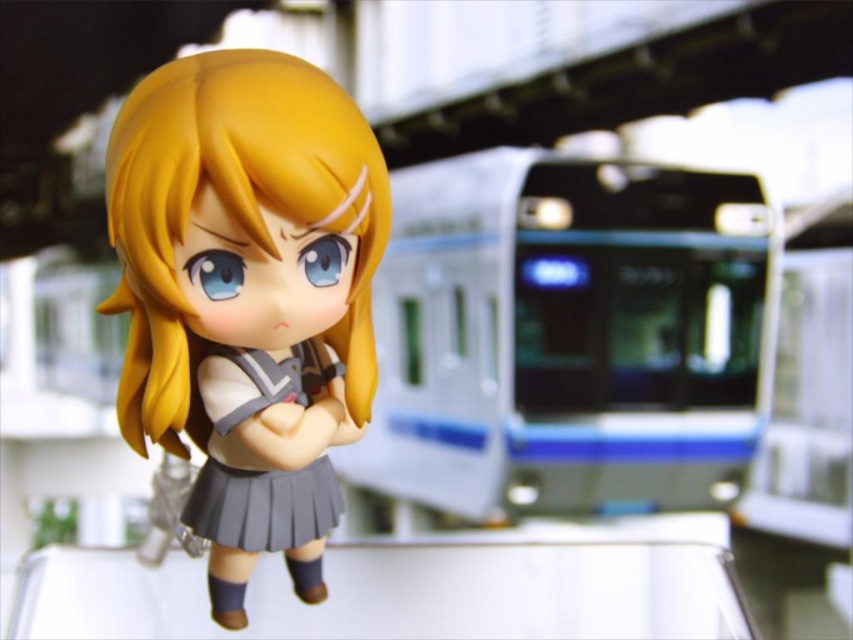
Question: Can you confirm if metallic silver train at center is thinner than gray pleated skirt at center?

Choices:
 (A) no
 (B) yes

Answer: (A)

Question: Where is metallic silver train at center located in relation to matte plastic doll at center in the image?

Choices:
 (A) below
 (B) above

Answer: (B)

Question: Does matte plastic doll at center have a greater width compared to gray pleated skirt at center?

Choices:
 (A) no
 (B) yes

Answer: (B)

Question: Which point appears closest to the camera in this image?

Choices:
 (A) (137, 204)
 (B) (233, 499)

Answer: (A)

Question: Which point is farther to the camera?

Choices:
 (A) (643, 218)
 (B) (305, 116)
 (C) (224, 532)

Answer: (A)

Question: Which point is closer to the camera?

Choices:
 (A) (198, 378)
 (B) (312, 488)

Answer: (A)